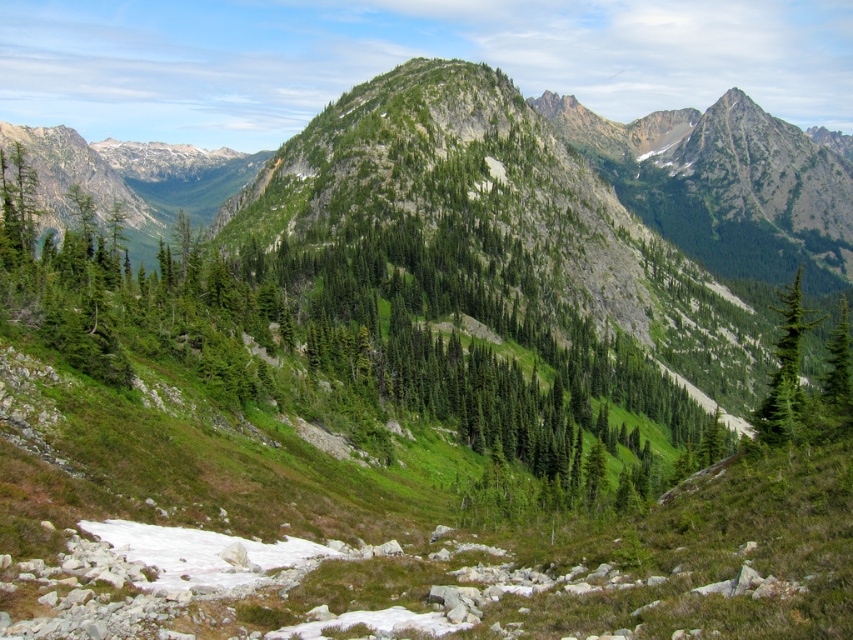
In the scene shown: You are a hiker navigating the mountain trail and need to locate the green textured tree at center. According to the coordinates provided, where exactly is this tree positioned in the image?

The green textured tree at center is located at point coordinates of 0.528 on the x axis and 0.420 on the y axis.

You are standing at the origin point of the coordinate system in the image. The green textured tree at right is located at a specific coordinate. Can you determine if the tree is positioned in the lower half of the image?

The green textured tree at right is located at point (x=785, y=371). Since the y coordinate is 0.921, which is above 0.5, the tree is positioned in the upper half of the image.